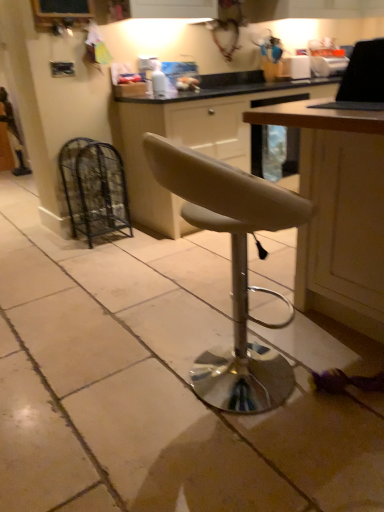
Where is `vacant space situated on the left part of wooden table at right`? This screenshot has width=384, height=512. vacant space situated on the left part of wooden table at right is located at coordinates (179, 325).